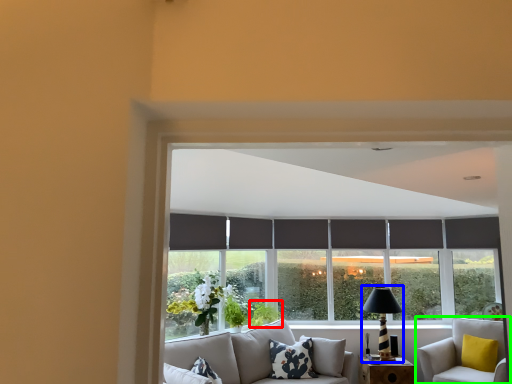
Question: Considering the real-world distances, which object is closest to plant (highlighted by a red box)? table lamp (highlighted by a blue box) or studio couch (highlighted by a green box).

Choices:
 (A) table lamp
 (B) studio couch

Answer: (A)